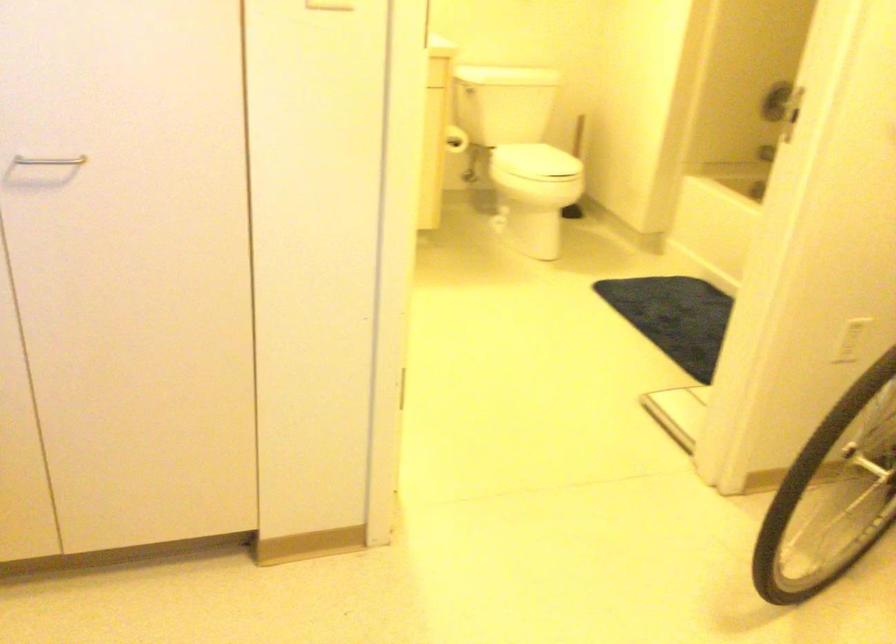
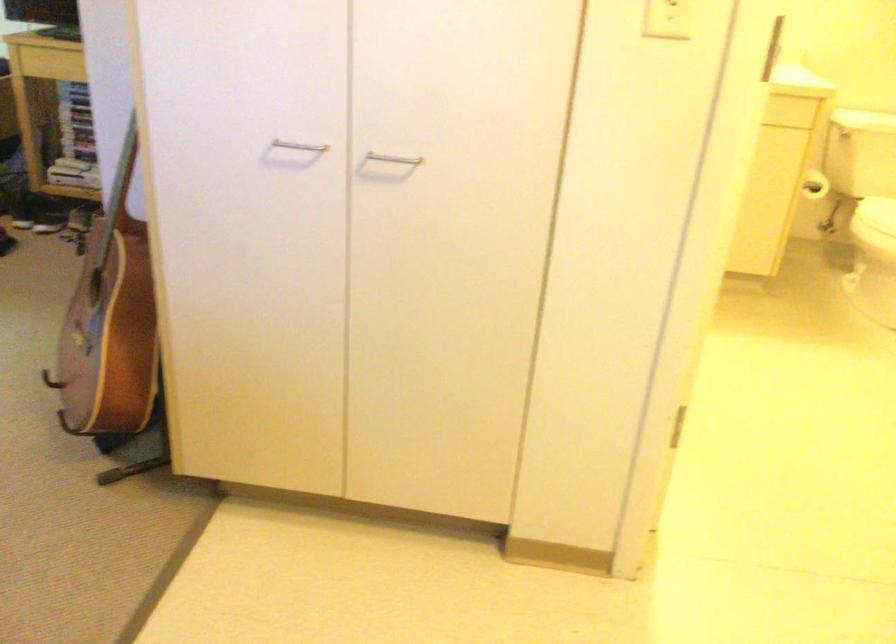
Where in the second image is the point corresponding to [512,166] from the first image?

(876, 214)